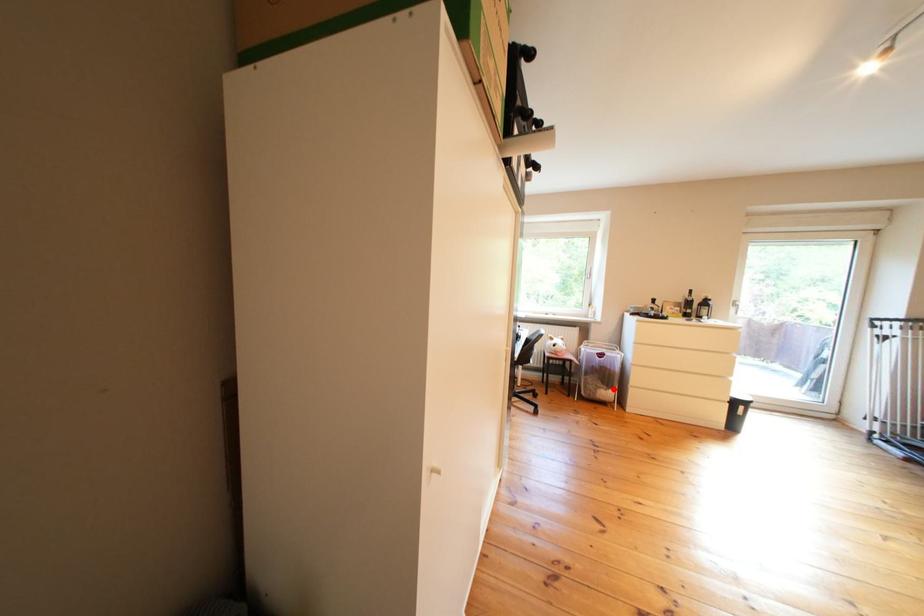
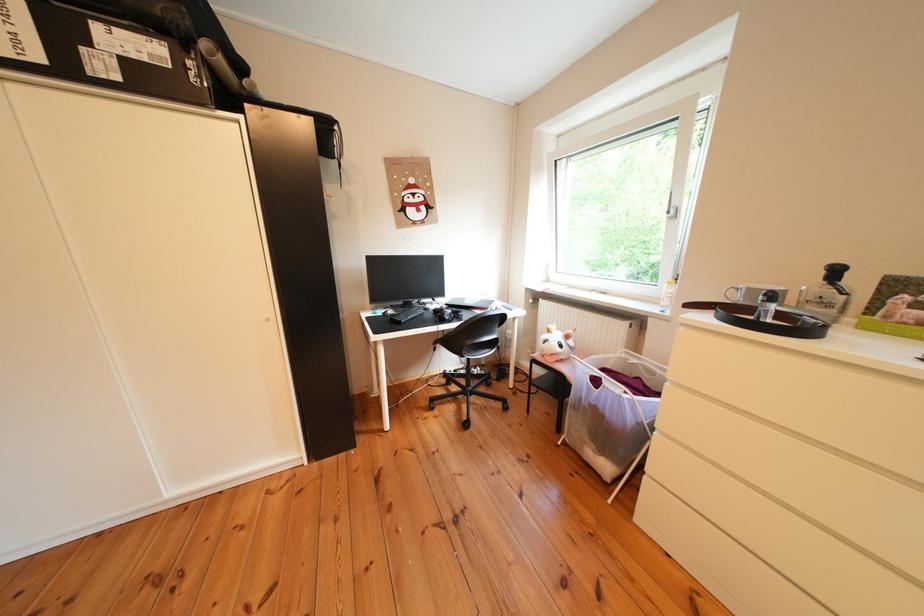
Question: I am providing you with two images of the same scene from different viewpoints. Given a red point in image1, look at the same physical point in image2. Is it:

Choices:
 (A) Closer to the viewpoint
 (B) Farther from the viewpoint

Answer: (A)